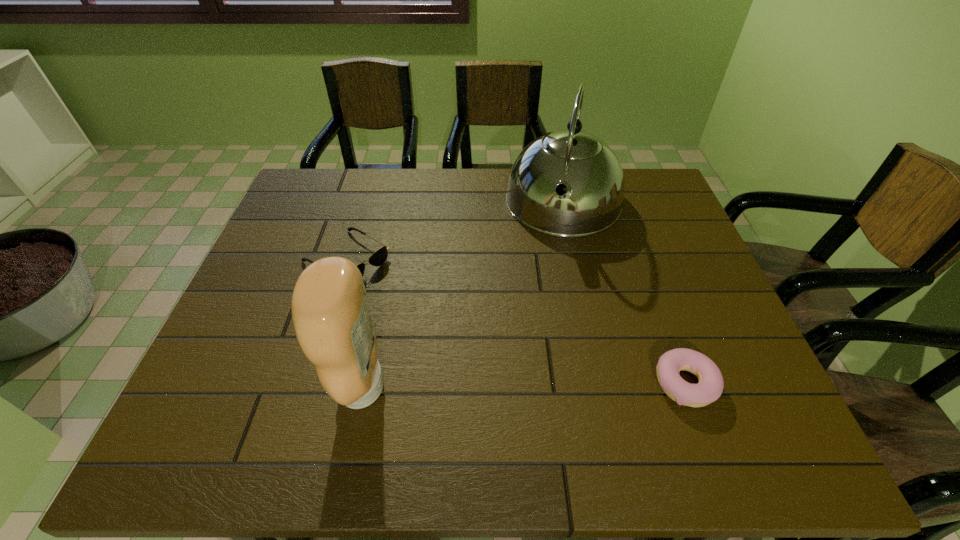
Where is `vacant spot on the desktop that is between the condiment and the doughnut and is positioned on the front-facing side of the sunglasses`? The image size is (960, 540). vacant spot on the desktop that is between the condiment and the doughnut and is positioned on the front-facing side of the sunglasses is located at coordinates (546, 385).

Where is `free space on the desktop that is between the condiment and the doughnut and is positioned from the spout of the kettle`? This screenshot has width=960, height=540. free space on the desktop that is between the condiment and the doughnut and is positioned from the spout of the kettle is located at coordinates (522, 386).